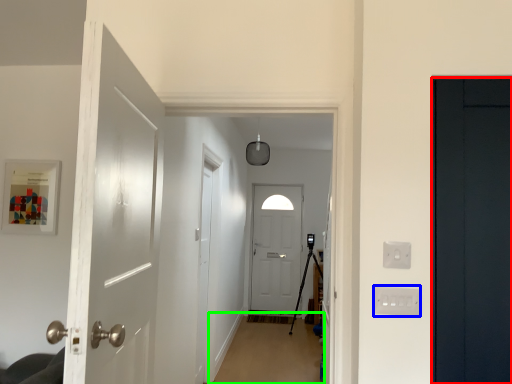
Question: Considering the real-world distances, which object is closest to door (highlighted by a red box)? electric outlet (highlighted by a blue box) or plain (highlighted by a green box).

Choices:
 (A) electric outlet
 (B) plain

Answer: (A)